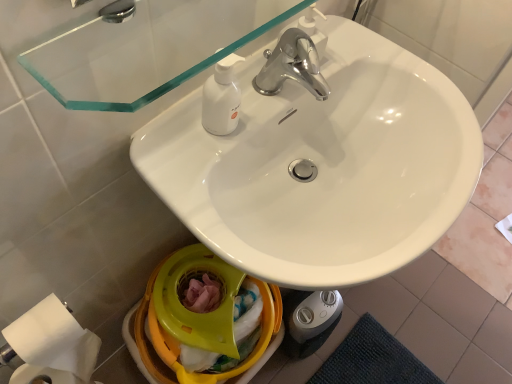
Question: Based on their sizes in the image, would you say white matte toilet paper at lower left is bigger or smaller than white glossy sink at center?

Choices:
 (A) big
 (B) small

Answer: (B)

Question: From the image's perspective, relative to white glossy sink at center, is white matte toilet paper at lower left above or below?

Choices:
 (A) above
 (B) below

Answer: (B)

Question: Which object is positioned closest to the white matte toilet paper at lower left?

Choices:
 (A) transparent glass mirror at upper center
 (B) yellow plastic bidet at lower center
 (C) white glossy sink at center

Answer: (B)

Question: Which object is the farthest from the white matte toilet paper at lower left?

Choices:
 (A) yellow plastic bidet at lower center
 (B) transparent glass mirror at upper center
 (C) white glossy sink at center

Answer: (C)